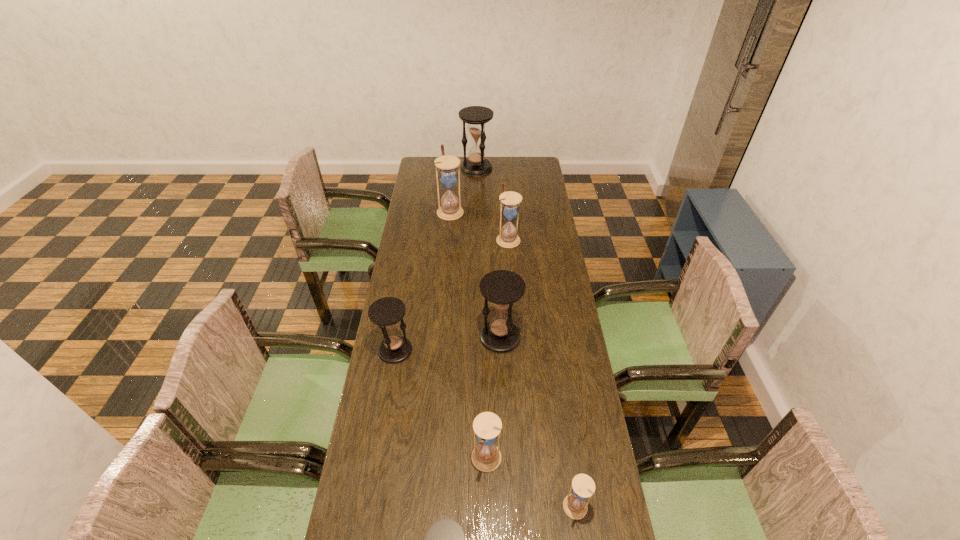
Locate an element on the screen. The image size is (960, 540). unoccupied area between the smallest white hourglass and the second farthest white hourglass is located at coordinates (541, 373).

Locate an element on the screen. This screenshot has height=540, width=960. free space that is in between the second farthest hourglass and the third nearest hourglass is located at coordinates tap(468, 335).

Image resolution: width=960 pixels, height=540 pixels. Identify the location of object that is the seventh closest one to the second white hourglass from right to left. (444, 539).

Identify which object is located as the fifth nearest to the farthest hourglass. Please provide its 2D coordinates. Your answer should be formatted as a tuple, i.e. [(x, y)], where the tuple contains the x and y coordinates of a point satisfying the conditions above.

[(486, 456)]

The image size is (960, 540). What are the coordinates of `the second closest hourglass to the nearest object` in the screenshot? It's located at (583, 487).

I want to click on hourglass object that ranks as the fifth closest to the second white hourglass from left to right, so click(x=508, y=238).

Image resolution: width=960 pixels, height=540 pixels. Find the location of `the second closest black hourglass to the smallest black hourglass`. the second closest black hourglass to the smallest black hourglass is located at coordinates (502, 288).

Locate which black hourglass is the third closest to the leftmost hourglass. Please provide its 2D coordinates. Your answer should be formatted as a tuple, i.e. [(x, y)], where the tuple contains the x and y coordinates of a point satisfying the conditions above.

[(476, 116)]

At what (x,y) coordinates should I click in order to perform the action: click on the closest white hourglass relative to the second farthest white hourglass. Please return your answer as a coordinate pair (x, y). This screenshot has width=960, height=540. Looking at the image, I should click on (450, 209).

Select which white hourglass is the second closest to the farthest hourglass. Please provide its 2D coordinates. Your answer should be formatted as a tuple, i.e. [(x, y)], where the tuple contains the x and y coordinates of a point satisfying the conditions above.

[(508, 238)]